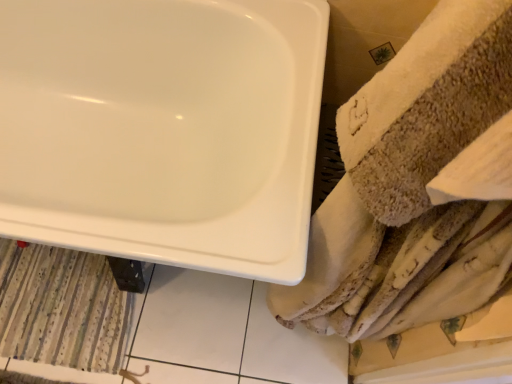
Question: Does striped fabric bath mat at lower left lie in front of white glossy bathtub at upper left?

Choices:
 (A) yes
 (B) no

Answer: (B)

Question: From the image's perspective, is striped fabric bath mat at lower left located beneath white glossy bathtub at upper left?

Choices:
 (A) no
 (B) yes

Answer: (B)

Question: Can you confirm if striped fabric bath mat at lower left is wider than white glossy bathtub at upper left?

Choices:
 (A) no
 (B) yes

Answer: (A)

Question: Is striped fabric bath mat at lower left behind white glossy bathtub at upper left?

Choices:
 (A) no
 (B) yes

Answer: (B)

Question: Is striped fabric bath mat at lower left not within white glossy bathtub at upper left?

Choices:
 (A) no
 (B) yes

Answer: (A)

Question: From a real-world perspective, is striped fabric bath mat at lower left beneath white glossy bathtub at upper left?

Choices:
 (A) yes
 (B) no

Answer: (A)

Question: Can striped fabric bath mat at lower left be found inside white glossy bathtub at upper left?

Choices:
 (A) yes
 (B) no

Answer: (A)

Question: Does white glossy bathtub at upper left have a greater height compared to striped fabric bath mat at lower left?

Choices:
 (A) no
 (B) yes

Answer: (B)

Question: From a real-world perspective, is white glossy bathtub at upper left physically above striped fabric bath mat at lower left?

Choices:
 (A) no
 (B) yes

Answer: (B)

Question: From the image's perspective, does white glossy bathtub at upper left appear higher than striped fabric bath mat at lower left?

Choices:
 (A) yes
 (B) no

Answer: (A)

Question: Considering the relative positions of white glossy bathtub at upper left and striped fabric bath mat at lower left in the image provided, is white glossy bathtub at upper left to the left of striped fabric bath mat at lower left from the viewer's perspective?

Choices:
 (A) no
 (B) yes

Answer: (A)

Question: Would you consider white glossy bathtub at upper left to be distant from striped fabric bath mat at lower left?

Choices:
 (A) yes
 (B) no

Answer: (B)

Question: From a real-world perspective, is white glossy bathtub at upper left positioned above or below striped fabric bath mat at lower left?

Choices:
 (A) above
 (B) below

Answer: (A)